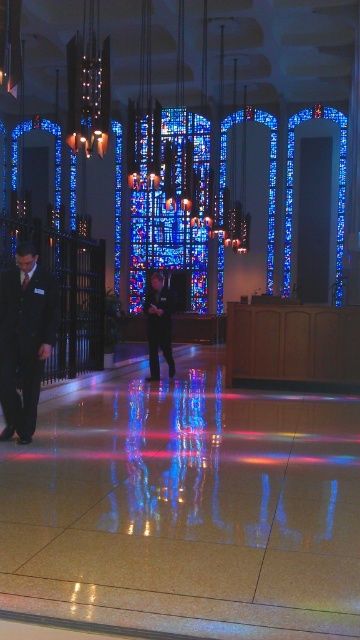
Who is positioned more to the left, dark blue suit at left or dark blue suit at center?

dark blue suit at left is more to the left.

Can you confirm if dark blue suit at left is positioned below dark blue suit at center?

Yes, dark blue suit at left is below dark blue suit at center.

Measure the distance between dark blue suit at left and camera.

dark blue suit at left is 18.36 feet from camera.

Find the location of a particular element. This screenshot has width=360, height=640. dark blue suit at left is located at coordinates (24, 339).